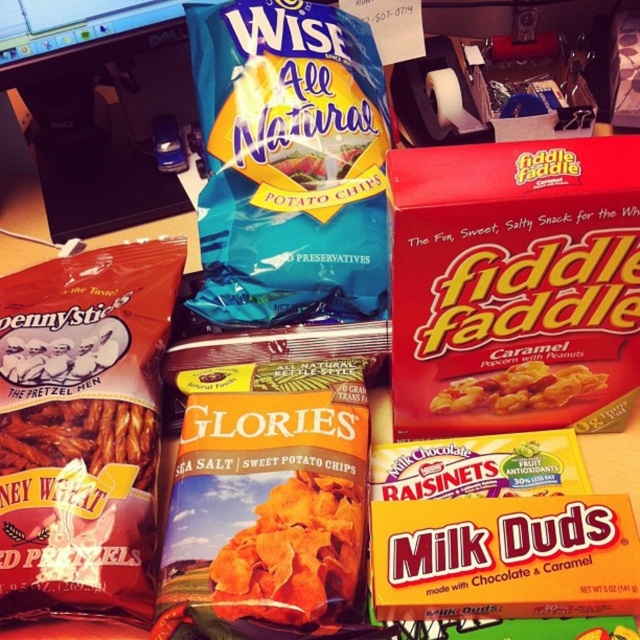
You are organizing a snack display on a desk and need to place a new item. The desk has a computer monitor and keyboard in the background. Where should you place the new item to avoid blocking the red cardboard box at upper right?

The red cardboard box at upper right is located at point (x=515, y=285), so place the new item away from that coordinate to avoid blocking it.

You are organizing snacks on a desk and need to place the red cardboard box at upper right and caramel popcorn at center into a shelf. The shelf has a width limit of 15 cm. Can both items fit side by side?

The red cardboard box at upper right might be wider than caramel popcorn at center. Since the shelf has a width limit of 15 cm, it is uncertain if both can fit without exceeding the limit. Check their combined width first.

You are organizing snacks on a desk and notice the red cardboard box at upper right and the caramel popcorn at center. Which item is placed above the other?

The red cardboard box at upper right is positioned over caramel popcorn at center, so it is placed above the caramel popcorn at center.